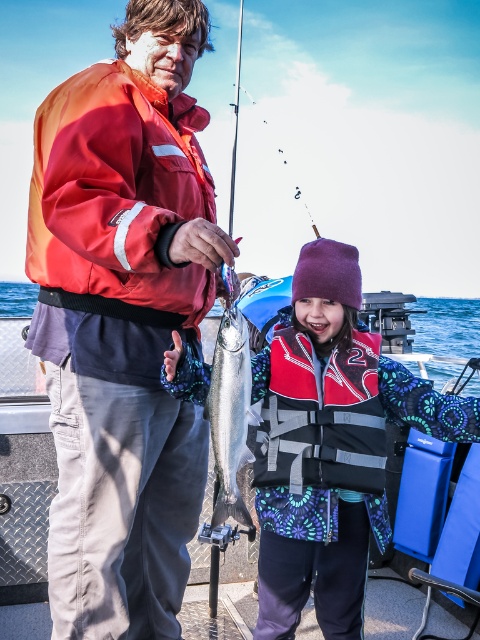
Question: Can you confirm if metallic blue boat at center is wider than red fabric life jacket at center?

Choices:
 (A) yes
 (B) no

Answer: (A)

Question: Which of the following is the farthest from the observer?

Choices:
 (A) tap(96, 284)
 (B) tap(193, 577)
 (C) tap(111, 452)

Answer: (B)

Question: Does matte red life jacket at upper center have a greater width compared to metallic blue boat at center?

Choices:
 (A) yes
 (B) no

Answer: (B)

Question: Among these objects, which one is nearest to the camera?

Choices:
 (A) metallic blue boat at center
 (B) shiny silver fish at center
 (C) matte red life jacket at upper center

Answer: (C)

Question: Can you confirm if matte red jacket at center is thinner than metallic blue boat at center?

Choices:
 (A) yes
 (B) no

Answer: (A)

Question: Which point is closer to the camera?

Choices:
 (A) red fabric life jacket at center
 (B) matte red jacket at center
 (C) shiny silver fish at center

Answer: (B)